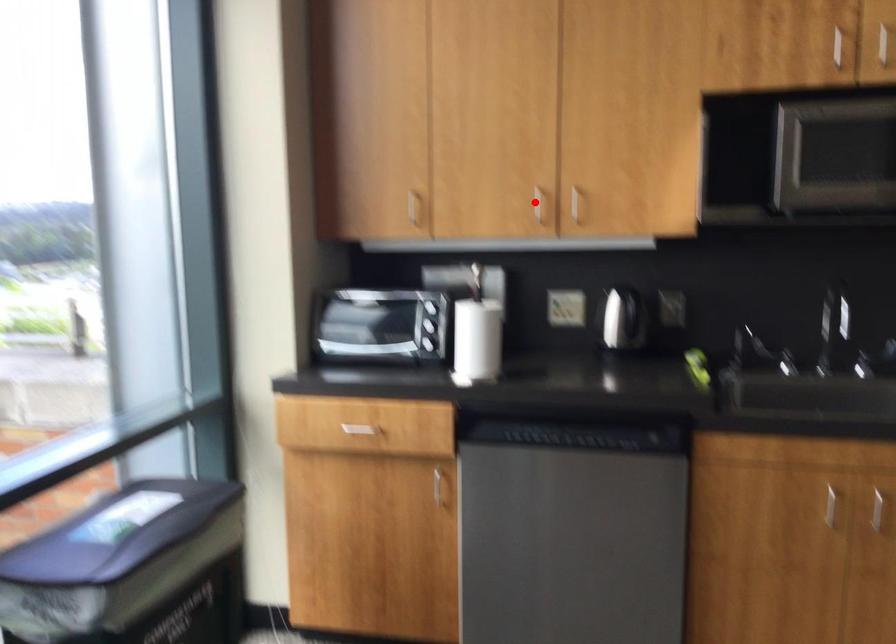
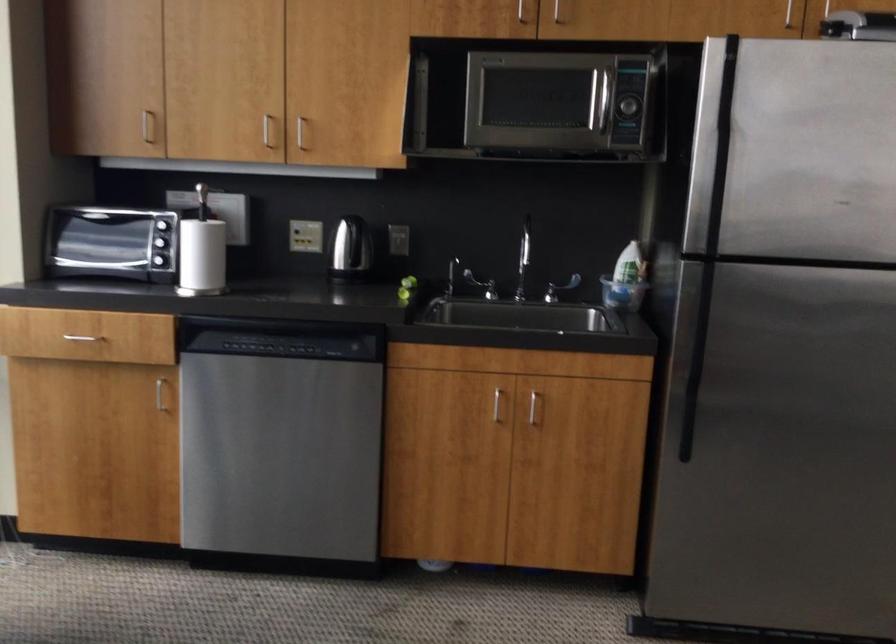
Where in the second image is the point corresponding to the highlighted location from the first image?

(266, 129)